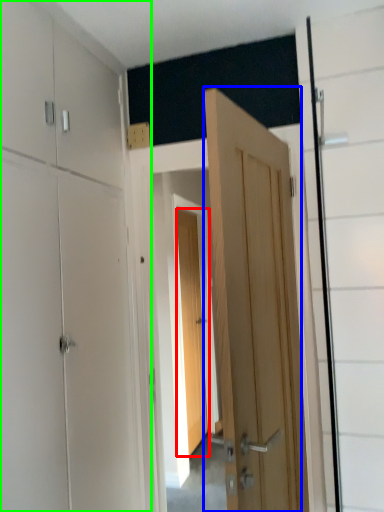
Question: Considering the real-world distances, which object is closest to door (highlighted by a red box)? door (highlighted by a blue box) or dresser (highlighted by a green box).

Choices:
 (A) door
 (B) dresser

Answer: (B)